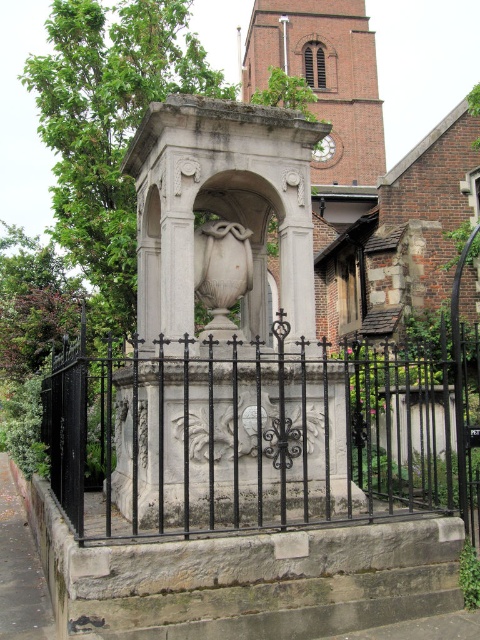
Question: Does white stone urn at center have a greater width compared to white marble vase at center?

Choices:
 (A) yes
 (B) no

Answer: (B)

Question: Does white stone urn at center appear over white marble vase at center?

Choices:
 (A) no
 (B) yes

Answer: (A)

Question: Which object is the closest to the black wrought iron fence at center?

Choices:
 (A) white marble vase at center
 (B) white stone urn at center

Answer: (A)

Question: Is the position of black wrought iron fence at center more distant than that of white stone urn at center?

Choices:
 (A) no
 (B) yes

Answer: (A)

Question: Estimate the real-world distances between objects in this image. Which object is closer to the white marble vase at center?

Choices:
 (A) white stone urn at center
 (B) black wrought iron fence at center

Answer: (A)

Question: Which of these objects is positioned closest to the white stone urn at center?

Choices:
 (A) white marble vase at center
 (B) black wrought iron fence at center

Answer: (A)